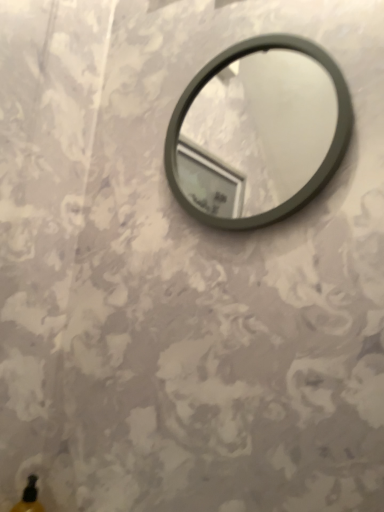
Question: From a real-world perspective, is matte gray mirror at center physically located above or below translucent yellow bottle at lower left?

Choices:
 (A) below
 (B) above

Answer: (B)

Question: Would you say matte gray mirror at center is inside or outside translucent yellow bottle at lower left?

Choices:
 (A) inside
 (B) outside

Answer: (B)

Question: Does point (231, 89) appear closer or farther from the camera than point (31, 503)?

Choices:
 (A) farther
 (B) closer

Answer: (A)

Question: Considering the positions of point (24, 499) and point (294, 74), is point (24, 499) closer or farther from the camera than point (294, 74)?

Choices:
 (A) farther
 (B) closer

Answer: (B)

Question: From their relative heights in the image, would you say translucent yellow bottle at lower left is taller or shorter than matte gray mirror at center?

Choices:
 (A) short
 (B) tall

Answer: (A)

Question: From the image's perspective, is translucent yellow bottle at lower left above or below matte gray mirror at center?

Choices:
 (A) below
 (B) above

Answer: (A)

Question: Is translucent yellow bottle at lower left inside the boundaries of matte gray mirror at center, or outside?

Choices:
 (A) inside
 (B) outside

Answer: (B)